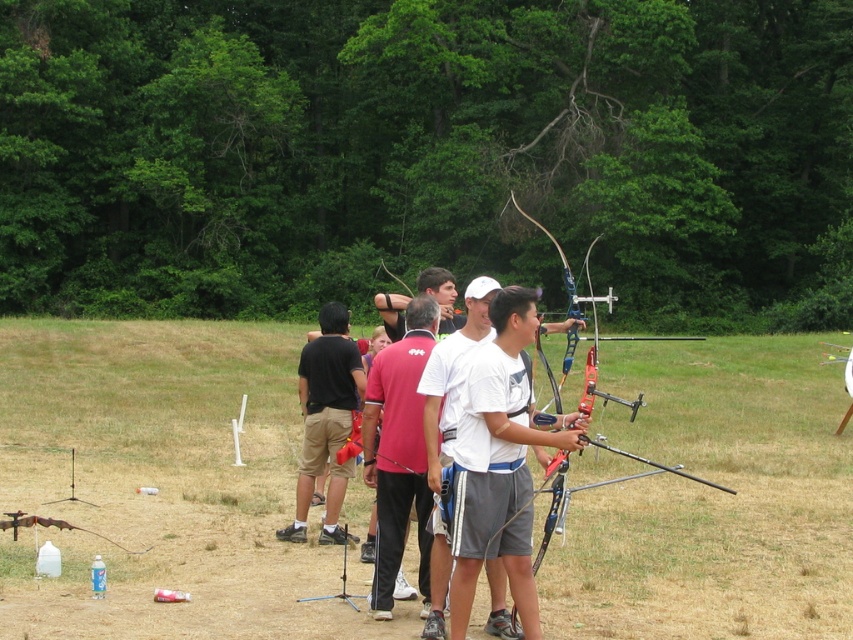
You are an archer standing at the edge of the grassy field at center and want to move towards the matte black shirt at center. Which direction should you move to reach it?

The grassy field at center is to the right of matte black shirt at center, so you should move to your left to reach the matte black shirt at center.

You are an archer standing at the point marked as point [515,308] in the image. You want to shoot an arrow to a target located 10 meters away. Can you reach the target with your current position?

The distance of point [515,308] from viewer is 7.04 meters. Since the target is 10 meters away, you are still 2.96 meters short. You need to move forward to reduce the distance to reach the target.

From the picture: What are the coordinates of the white matte shirt at center in the image?

The coordinates of the white matte shirt at center are at point (x=500, y=461).